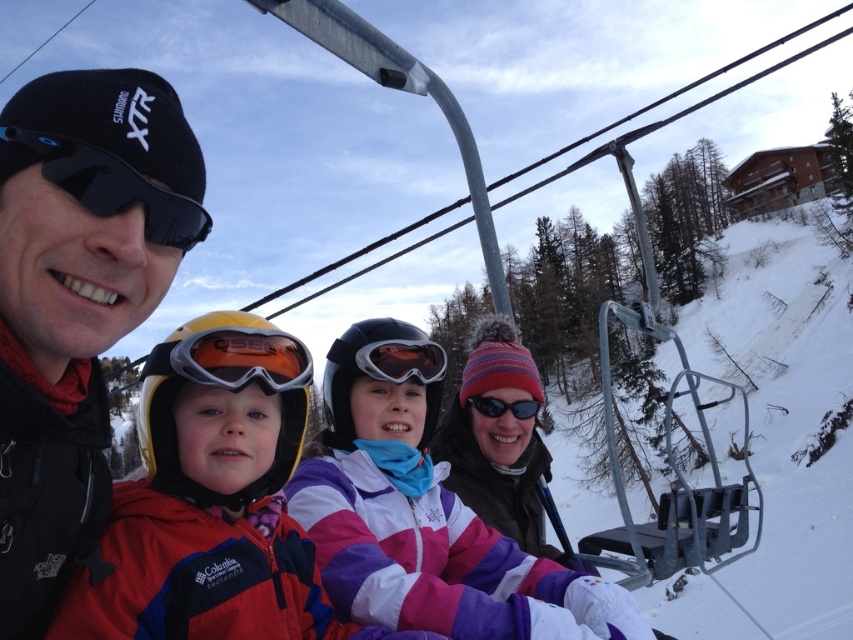
Question: Which of these objects is positioned farthest from the matte black goggles at center?

Choices:
 (A) black matte goggles at center
 (B) black matte ski goggles at left
 (C) orange reflective lens goggles at center
 (D) black matte goggles at left

Answer: (B)

Question: Which point is farther to the camera?

Choices:
 (A) click(358, 353)
 (B) click(15, 525)
 (C) click(512, 412)
 (D) click(305, 378)

Answer: (C)

Question: Where is purple/white/pink ski jacket at center located in relation to black matte goggles at left in the image?

Choices:
 (A) right
 (B) left

Answer: (A)

Question: Estimate the real-world distances between objects in this image. Which object is farther from the black matte ski goggles at left?

Choices:
 (A) matte black goggles at center
 (B) black matte goggles at left
 (C) black matte goggles at center

Answer: (C)

Question: Does black matte ski goggles at left lie in front of orange reflective goggles at center?

Choices:
 (A) no
 (B) yes

Answer: (B)

Question: Does black matte ski goggles at left have a greater width compared to purple/white/pink ski jacket at center?

Choices:
 (A) yes
 (B) no

Answer: (A)